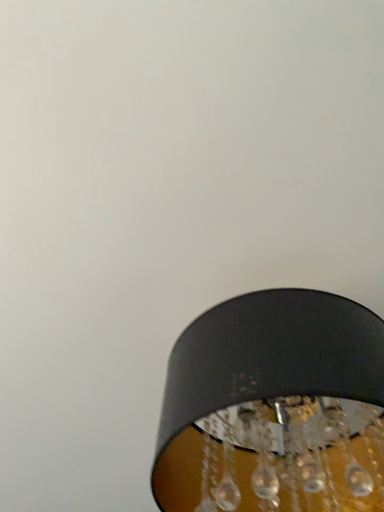
Describe the element at coordinates (274, 408) in the screenshot. I see `matte black lampshade at lower right` at that location.

Locate an element on the screen. Image resolution: width=384 pixels, height=512 pixels. matte black lampshade at lower right is located at coordinates (274, 408).

Find the location of a particular element. The height and width of the screenshot is (512, 384). matte black lampshade at lower right is located at coordinates (274, 408).